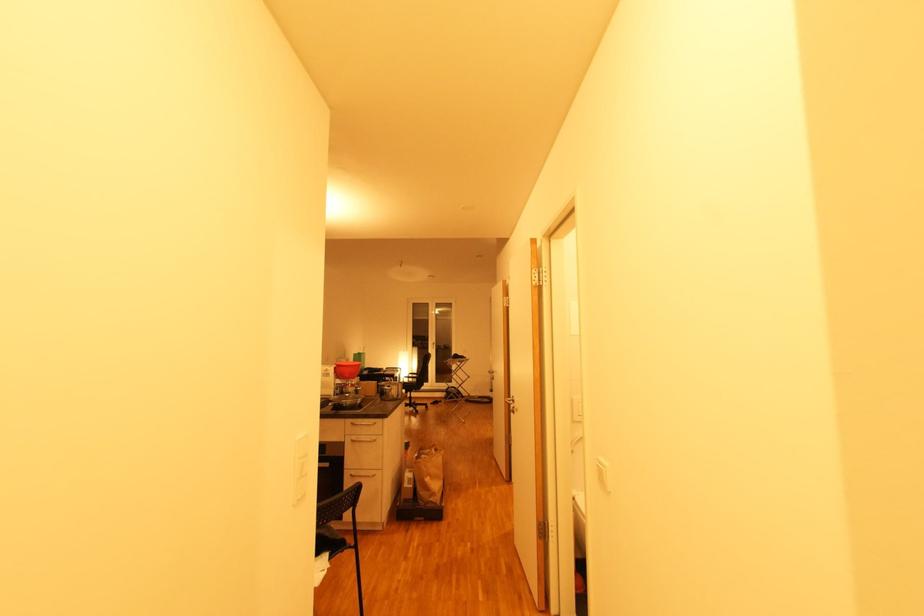
The location [346,370] corresponds to which object?

It refers to a red plastic bowl.